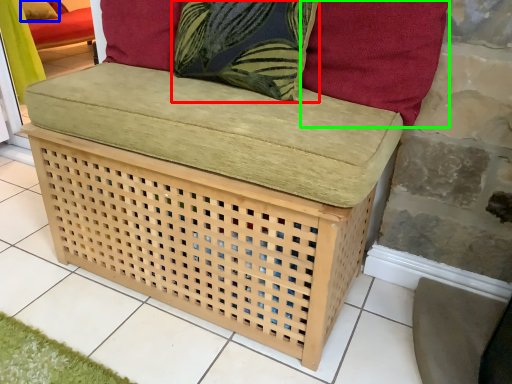
Question: Which is nearer to the throw pillow (highlighted by a red box)? pillow (highlighted by a blue box) or pillow (highlighted by a green box).

Choices:
 (A) pillow
 (B) pillow

Answer: (B)